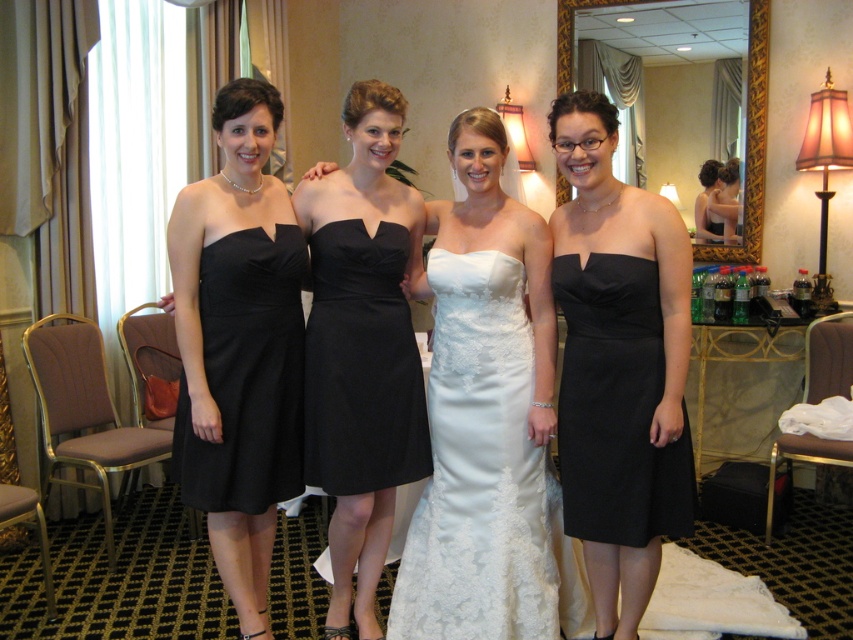
Is the position of matte black dress at center more distant than that of black satin dress at left?

Yes, matte black dress at center is further from the viewer.

Who is lower down, matte black dress at center or black satin dress at left?

matte black dress at center is below.

The image size is (853, 640). Identify the location of matte black dress at center. (363, 348).

Who is lower down, matte black dress at center or black satin dress at right?

Positioned lower is black satin dress at right.

Find the location of a particular element. Image resolution: width=853 pixels, height=640 pixels. matte black dress at center is located at coordinates coord(363,348).

Between matte black dress at left and white satin dress at center, which one appears on the right side from the viewer's perspective?

white satin dress at center is more to the right.

Measure the distance between matte black dress at left and camera.

They are 7.01 feet apart.

Does point (257, 204) lie in front of point (440, 324)?

Yes, point (257, 204) is in front of point (440, 324).

You are a GUI agent. You are given a task and a screenshot of the screen. Output one action in this format:
    pyautogui.click(x=<x>, y=<y>)
    Task: Click on the matte black dress at left
    The height and width of the screenshot is (640, 853).
    Given the screenshot: What is the action you would take?
    pyautogui.click(x=239, y=346)